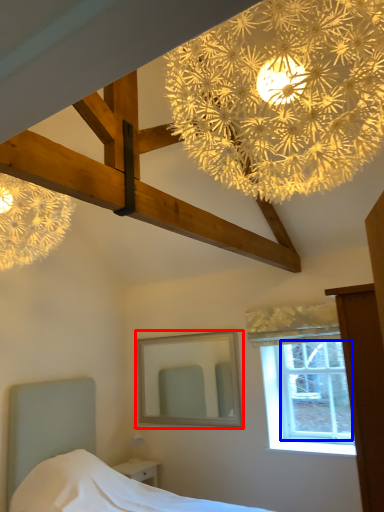
Question: Which object is further to the camera taking this photo, mirror (highlighted by a red box) or window screen (highlighted by a blue box)?

Choices:
 (A) mirror
 (B) window screen

Answer: (A)